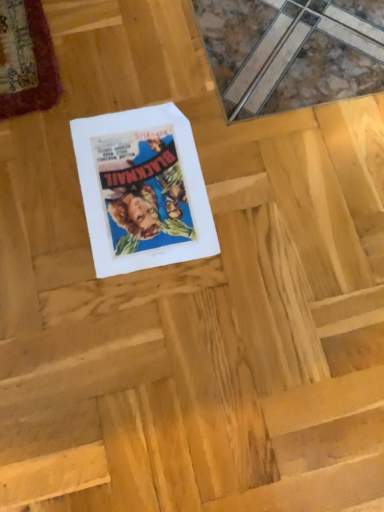
Find the location of `free spot above white paper at center (from a real-world perspective)`. free spot above white paper at center (from a real-world perspective) is located at coordinates (135, 175).